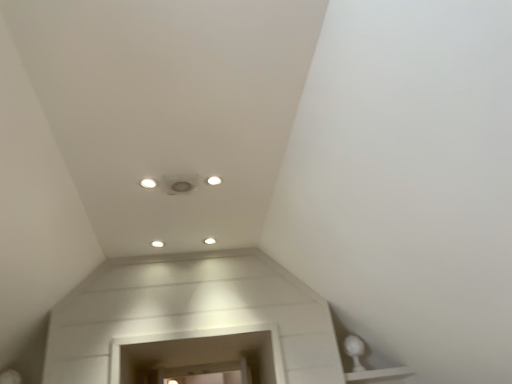
Question: Should I look upward or downward to see white glossy light fixture at upper center, the second dot in the back-to-front sequence?

Choices:
 (A) up
 (B) down

Answer: (A)

Question: Does white glossy light fixture at upper center, marked as the 1th dot in a top-to-bottom arrangement, come in front of white glossy light fixture at center, arranged as the 2th dot when viewed from the top?

Choices:
 (A) no
 (B) yes

Answer: (B)

Question: Is white glossy light fixture at upper center, which is the 1th dot in left-to-right order, at the left side of white glossy light fixture at center, which is the 2th dot from front to back?

Choices:
 (A) no
 (B) yes

Answer: (B)

Question: Is the depth of white glossy light fixture at upper center, the first dot when ordered from front to back, greater than that of white glossy light fixture at center, which is the 2th dot from front to back?

Choices:
 (A) yes
 (B) no

Answer: (B)

Question: From the image's perspective, is white glossy light fixture at upper center, the first dot when ordered from front to back, on white glossy light fixture at center, the 1th dot positioned from the back?

Choices:
 (A) no
 (B) yes

Answer: (B)

Question: Considering the relative sizes of white glossy light fixture at upper center, the second dot in the back-to-front sequence, and white glossy light fixture at center, positioned as the second dot in left-to-right order, in the image provided, is white glossy light fixture at upper center, the second dot in the back-to-front sequence, wider than white glossy light fixture at center, positioned as the second dot in left-to-right order,?

Choices:
 (A) yes
 (B) no

Answer: (B)

Question: Considering the relative sizes of white glossy light fixture at upper center, the 2th dot viewed from the right, and white glossy light fixture at center, which appears as the first dot when ordered from the bottom, in the image provided, is white glossy light fixture at upper center, the 2th dot viewed from the right, shorter than white glossy light fixture at center, which appears as the first dot when ordered from the bottom,?

Choices:
 (A) no
 (B) yes

Answer: (B)

Question: From the image's perspective, is white glossy light fixture at center, the 1th dot positioned from the back, located beneath white glossy light fixture at upper center, the second dot in the back-to-front sequence?

Choices:
 (A) yes
 (B) no

Answer: (A)

Question: Is white glossy light fixture at center, arranged as the 2th dot when viewed from the top, smaller than white glossy light fixture at upper center, placed as the 2th dot when sorted from bottom to top?

Choices:
 (A) yes
 (B) no

Answer: (B)

Question: From the image's perspective, is white glossy light fixture at center, arranged as the 2th dot when viewed from the top, over white glossy light fixture at upper center, the first dot when ordered from front to back?

Choices:
 (A) no
 (B) yes

Answer: (A)

Question: Could you tell me if white glossy light fixture at center, positioned as the second dot in left-to-right order, is facing white glossy light fixture at upper center, the 2th dot viewed from the right?

Choices:
 (A) no
 (B) yes

Answer: (B)

Question: Can you confirm if white glossy light fixture at center, positioned as the second dot in left-to-right order, is thinner than white glossy light fixture at upper center, the 2th dot viewed from the right?

Choices:
 (A) no
 (B) yes

Answer: (A)

Question: Can you confirm if white glossy light fixture at center, positioned as the second dot in left-to-right order, is positioned to the right of white glossy light fixture at upper center, which is the 1th dot in left-to-right order?

Choices:
 (A) yes
 (B) no

Answer: (A)

Question: From a real-world perspective, relative to white glossy light fixture at center, positioned as the second dot in left-to-right order, is white glossy light fixture at upper center, the 2th dot viewed from the right, vertically above or below?

Choices:
 (A) below
 (B) above

Answer: (B)